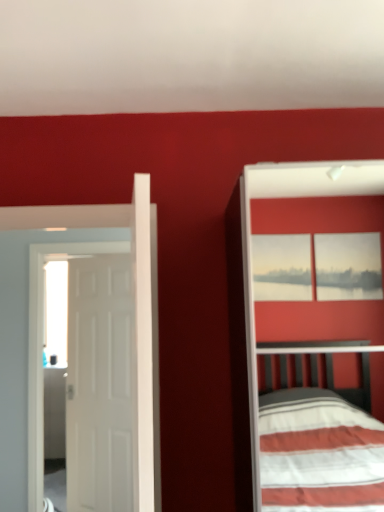
Find the location of a particular element. This screenshot has height=512, width=384. white matte door at left, the 2th door positioned from the back is located at coordinates (82, 353).

Describe the element at coordinates (82, 353) in the screenshot. I see `white matte door at left, the 2th door positioned from the back` at that location.

Find the location of a particular element. The width and height of the screenshot is (384, 512). white matte door at left, acting as the first door starting from the back is located at coordinates (100, 384).

Describe the element at coordinates (100, 384) in the screenshot. I see `white matte door at left, which is counted as the second door, starting from the front` at that location.

At what (x,y) coordinates should I click in order to perform the action: click on white matte door at left, which is counted as the 1th door, starting from the front. Please return your answer as a coordinate pair (x, y). Looking at the image, I should click on (82, 353).

Based on the photo, considering the relative positions of white matte door at left, acting as the first door starting from the back, and white matte door at left, the 2th door positioned from the back, in the image provided, is white matte door at left, acting as the first door starting from the back, to the left or to the right of white matte door at left, the 2th door positioned from the back,?

white matte door at left, acting as the first door starting from the back, is to the left of white matte door at left, the 2th door positioned from the back.

Considering their positions, is white matte door at left, which is counted as the second door, starting from the front, located in front of or behind white matte door at left, which is counted as the 1th door, starting from the front?

white matte door at left, which is counted as the second door, starting from the front, is positioned farther from the viewer than white matte door at left, which is counted as the 1th door, starting from the front.

Considering the positions of point (110, 307) and point (40, 249), is point (110, 307) closer or farther from the camera than point (40, 249)?

Point (110, 307) is positioned farther from the camera compared to point (40, 249).

From the image's perspective, is white matte door at left, which is counted as the second door, starting from the front, under white matte door at left, which is counted as the 1th door, starting from the front?

Indeed, from the image's perspective, white matte door at left, which is counted as the second door, starting from the front, is shown beneath white matte door at left, which is counted as the 1th door, starting from the front.

From a real-world perspective, is white matte door at left, acting as the first door starting from the back, above or below white matte door at left, which is counted as the 1th door, starting from the front?

Clearly, from a real-world perspective, white matte door at left, acting as the first door starting from the back, is below white matte door at left, which is counted as the 1th door, starting from the front.

Can you confirm if white matte door at left, which is counted as the second door, starting from the front, is wider than white matte door at left, which is counted as the 1th door, starting from the front?

In fact, white matte door at left, which is counted as the second door, starting from the front, might be narrower than white matte door at left, which is counted as the 1th door, starting from the front.

From the picture: Considering the relative sizes of white matte door at left, which is counted as the second door, starting from the front, and white matte door at left, which is counted as the 1th door, starting from the front, in the image provided, is white matte door at left, which is counted as the second door, starting from the front, taller than white matte door at left, which is counted as the 1th door, starting from the front,?

Indeed, white matte door at left, which is counted as the second door, starting from the front, has a greater height compared to white matte door at left, which is counted as the 1th door, starting from the front.

Considering the relative sizes of white matte door at left, which is counted as the second door, starting from the front, and white matte door at left, the 2th door positioned from the back, in the image provided, is white matte door at left, which is counted as the second door, starting from the front, smaller than white matte door at left, the 2th door positioned from the back,?

Yes, white matte door at left, which is counted as the second door, starting from the front, is smaller than white matte door at left, the 2th door positioned from the back.

Is white matte door at left, which is counted as the second door, starting from the front, positioned beyond the bounds of white matte door at left, the 2th door positioned from the back?

Indeed, white matte door at left, which is counted as the second door, starting from the front, is completely outside white matte door at left, the 2th door positioned from the back.

Is white matte door at left, which is counted as the second door, starting from the front, not near white matte door at left, which is counted as the 1th door, starting from the front?

white matte door at left, which is counted as the second door, starting from the front, is actually quite close to white matte door at left, which is counted as the 1th door, starting from the front.

Is white matte door at left, which is counted as the second door, starting from the front, positioned with its back to white matte door at left, the 2th door positioned from the back?

No, white matte door at left, which is counted as the second door, starting from the front, is not facing the opposite direction of white matte door at left, the 2th door positioned from the back.

Locate an element on the screen. The height and width of the screenshot is (512, 384). door lying on the left of white matte door at left, which is counted as the 1th door, starting from the front is located at coordinates (100, 384).

Does white matte door at left, the 2th door positioned from the back, appear on the right side of white matte door at left, acting as the first door starting from the back?

Yes, white matte door at left, the 2th door positioned from the back, is to the right of white matte door at left, acting as the first door starting from the back.

Considering their positions, is white matte door at left, the 2th door positioned from the back, located in front of or behind white matte door at left, acting as the first door starting from the back?

white matte door at left, the 2th door positioned from the back, is in front of white matte door at left, acting as the first door starting from the back.

Is point (91, 418) closer to camera compared to point (70, 320)?

That is True.

From the image's perspective, is white matte door at left, the 2th door positioned from the back, on top of white matte door at left, which is counted as the second door, starting from the front?

Yes, from the image's perspective, white matte door at left, the 2th door positioned from the back, is over white matte door at left, which is counted as the second door, starting from the front.

From a real-world perspective, which object stands above the other?

white matte door at left, the 2th door positioned from the back, is physically above.

Considering the relative sizes of white matte door at left, which is counted as the 1th door, starting from the front, and white matte door at left, acting as the first door starting from the back, in the image provided, is white matte door at left, which is counted as the 1th door, starting from the front, wider than white matte door at left, acting as the first door starting from the back,?

Correct, the width of white matte door at left, which is counted as the 1th door, starting from the front, exceeds that of white matte door at left, acting as the first door starting from the back.

Which of these two, white matte door at left, which is counted as the 1th door, starting from the front, or white matte door at left, acting as the first door starting from the back, stands shorter?

white matte door at left, which is counted as the 1th door, starting from the front.

Considering the sizes of objects white matte door at left, the 2th door positioned from the back, and white matte door at left, acting as the first door starting from the back, in the image provided, who is bigger, white matte door at left, the 2th door positioned from the back, or white matte door at left, acting as the first door starting from the back,?

white matte door at left, the 2th door positioned from the back.

Is white matte door at left, the 2th door positioned from the back, inside or outside of white matte door at left, acting as the first door starting from the back?

white matte door at left, the 2th door positioned from the back, is located beyond the bounds of white matte door at left, acting as the first door starting from the back.

Is the surface of white matte door at left, the 2th door positioned from the back, in direct contact with white matte door at left, which is counted as the second door, starting from the front?

Yes, white matte door at left, the 2th door positioned from the back, and white matte door at left, which is counted as the second door, starting from the front, clearly make contact.

Is white matte door at left, the 2th door positioned from the back, turned away from white matte door at left, acting as the first door starting from the back?

Yes, white matte door at left, the 2th door positioned from the back, is positioned with its back facing white matte door at left, acting as the first door starting from the back.

Looking at this image, how many degrees apart are the facing directions of white matte door at left, which is counted as the 1th door, starting from the front, and white matte door at left, which is counted as the second door, starting from the front?

The facing directions of white matte door at left, which is counted as the 1th door, starting from the front, and white matte door at left, which is counted as the second door, starting from the front, are 28.8 degrees apart.

This screenshot has height=512, width=384. I want to click on door directly beneath the white matte door at left, which is counted as the 1th door, starting from the front (from a real-world perspective), so click(x=100, y=384).

This screenshot has width=384, height=512. What are the coordinates of `door that is on the right side of white matte door at left, acting as the first door starting from the back` in the screenshot? It's located at [x=82, y=353].

Where is `door below the white matte door at left, the 2th door positioned from the back (from a real-world perspective)`? door below the white matte door at left, the 2th door positioned from the back (from a real-world perspective) is located at coordinates (100, 384).